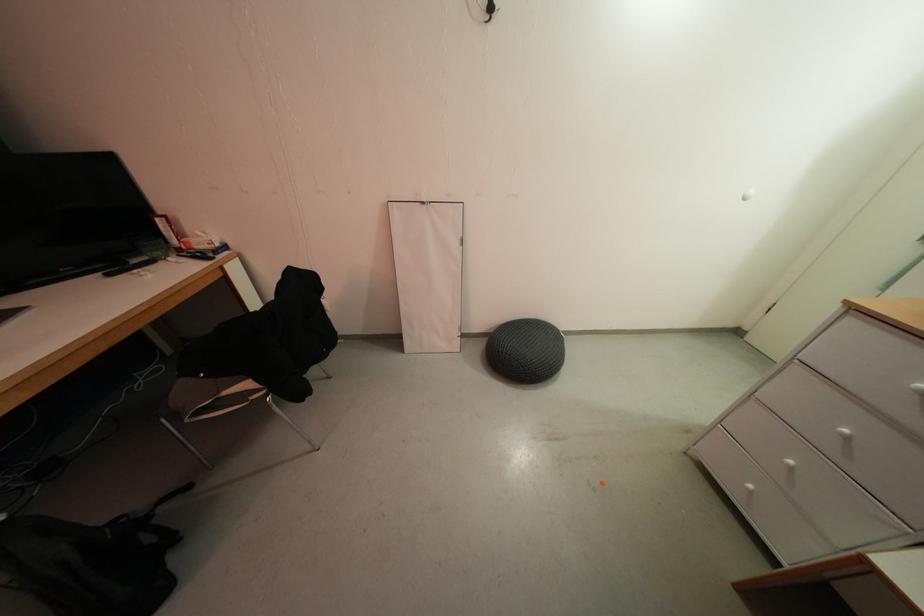
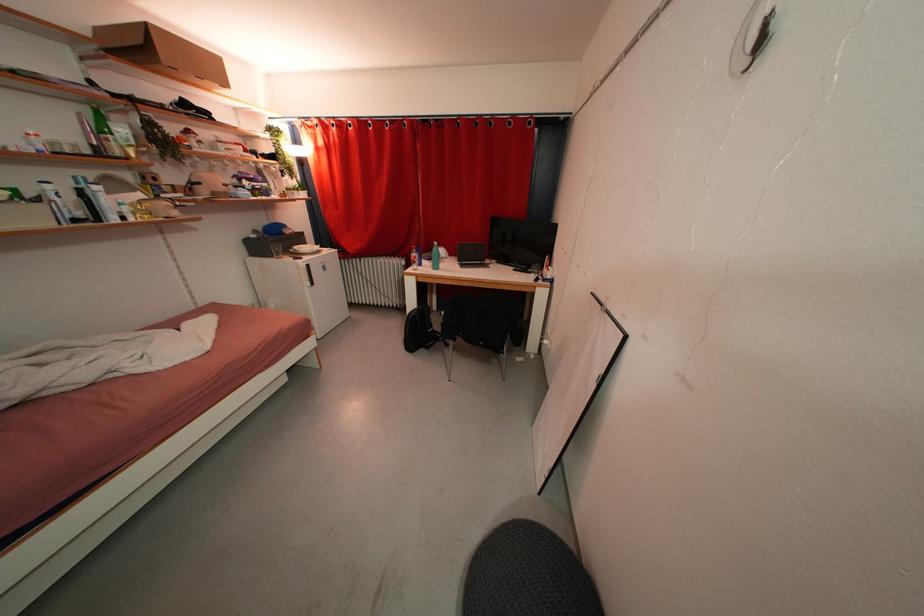
Locate, in the second image, the point that corresponds to the point at 223,256 in the first image.

(551, 284)